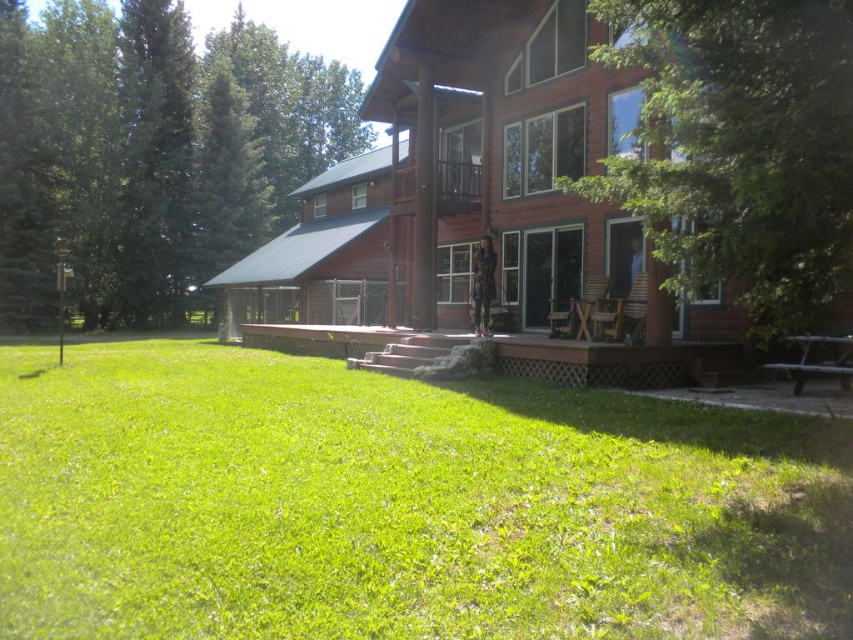
Question: Does green grass at lower left come in front of green leafy tree at upper right?

Choices:
 (A) yes
 (B) no

Answer: (A)

Question: Based on their relative distances, which object is farther from the green leafy tree at upper right?

Choices:
 (A) green grass at lower left
 (B) green leafy tree at upper left

Answer: (B)

Question: Which of these objects is positioned closest to the brown wooden cabin at center?

Choices:
 (A) green leafy tree at upper right
 (B) green leafy tree at upper left

Answer: (B)

Question: Does brown wooden cabin at center have a smaller size compared to green leafy tree at upper left?

Choices:
 (A) yes
 (B) no

Answer: (A)

Question: Which object is farther from the camera taking this photo?

Choices:
 (A) green grass at lower left
 (B) brown wooden cabin at center
 (C) green leafy tree at upper left
 (D) green leafy tree at upper right

Answer: (C)

Question: Where is brown wooden cabin at center located in relation to green leafy tree at upper right in the image?

Choices:
 (A) right
 (B) left

Answer: (B)